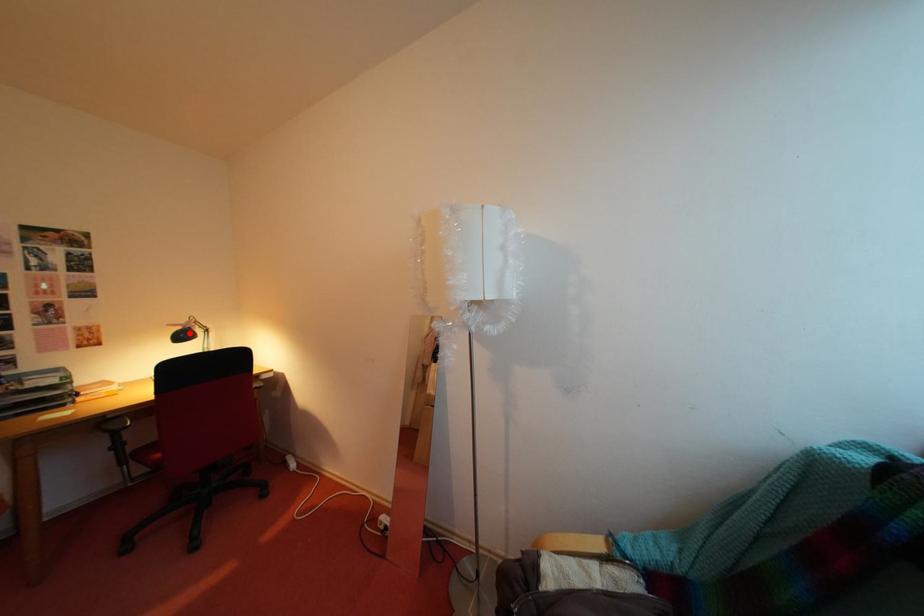
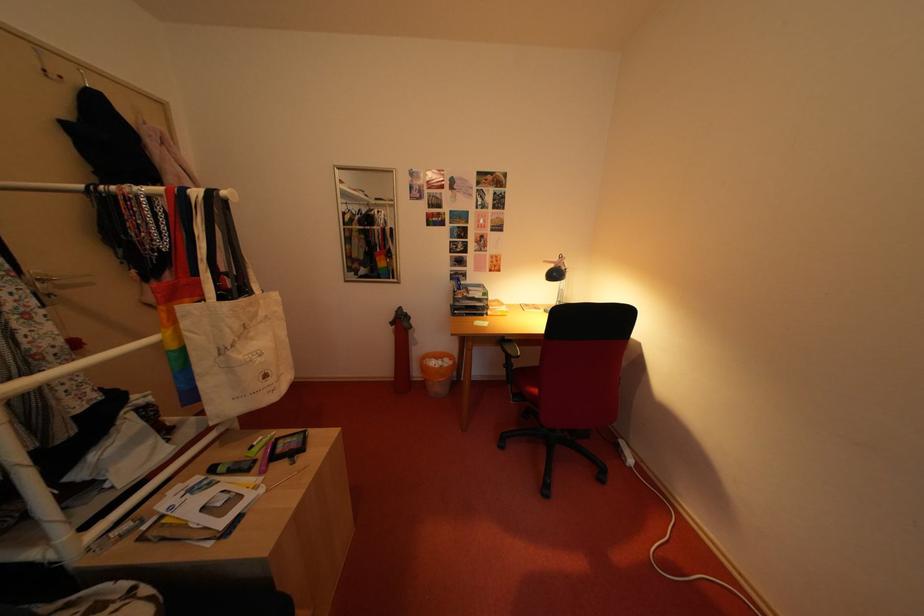
Locate, in the second image, the point that corresponds to the highlighted location in the first image.

(563, 270)